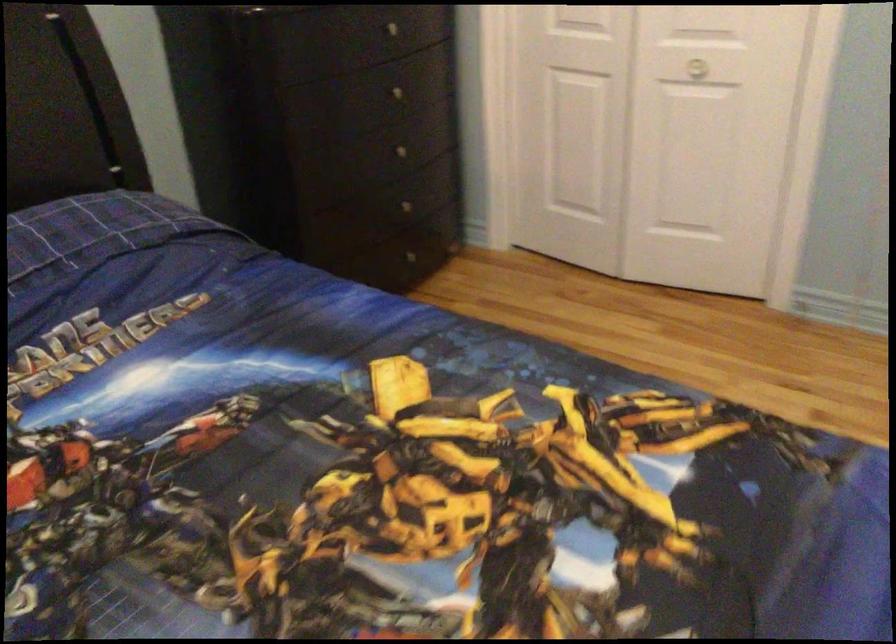
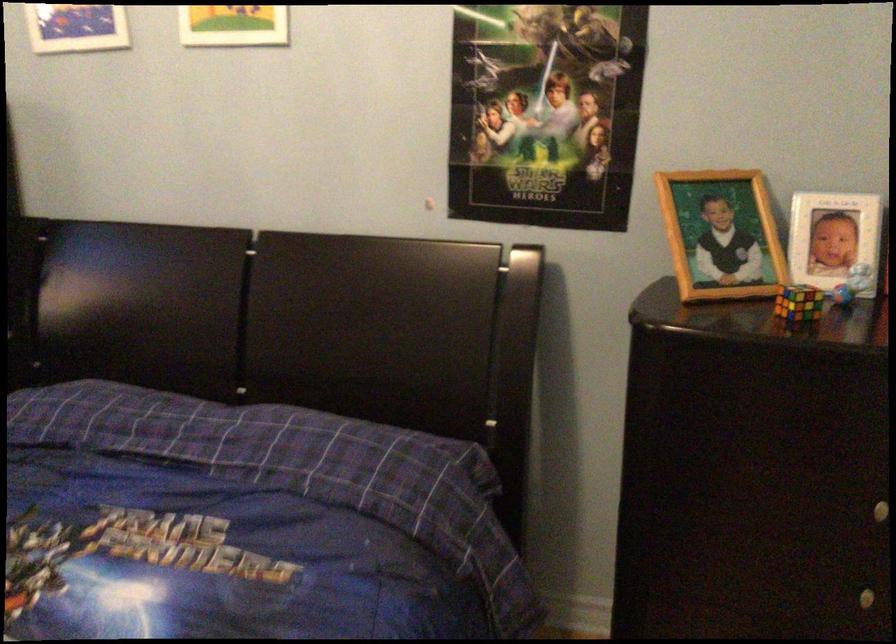
In the second image, find the point that corresponds to point (403, 151) in the first image.

(868, 597)